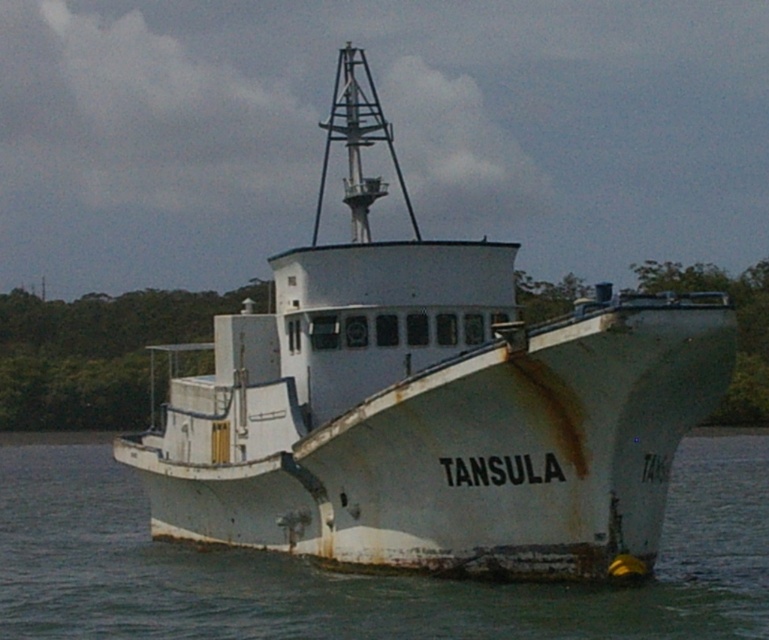
Question: Does white matte boat at center appear under white matte water at center?

Choices:
 (A) yes
 (B) no

Answer: (B)

Question: Can you confirm if white matte boat at center is positioned above white matte water at center?

Choices:
 (A) no
 (B) yes

Answer: (B)

Question: Is white matte boat at center closer to camera compared to white matte water at center?

Choices:
 (A) no
 (B) yes

Answer: (B)

Question: Which of the following is the closest to the observer?

Choices:
 (A) white matte water at center
 (B) white matte boat at center

Answer: (B)

Question: Which of the following is the farthest from the observer?

Choices:
 (A) (684, 321)
 (B) (35, 529)

Answer: (B)